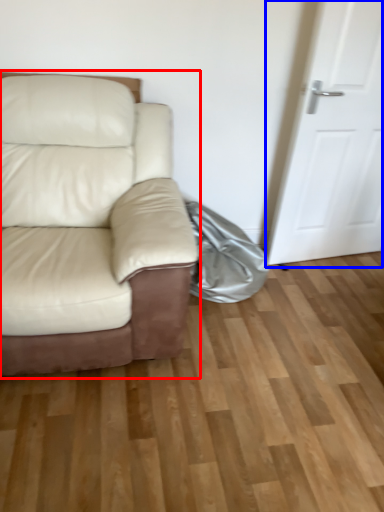
Question: Which object appears farthest to the camera in this image, studio couch (highlighted by a red box) or door (highlighted by a blue box)?

Choices:
 (A) studio couch
 (B) door

Answer: (B)